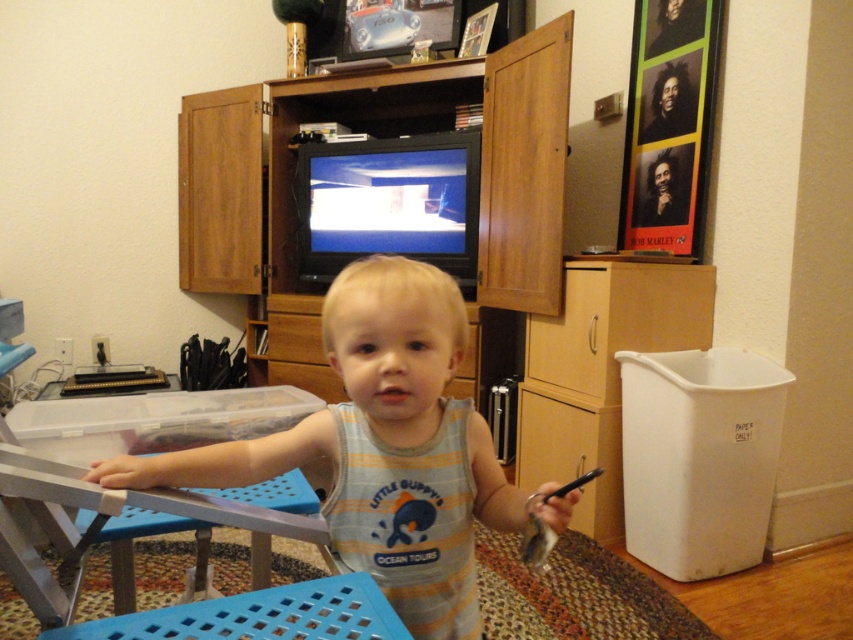
Question: Observing the image, what is the correct spatial positioning of gray striped tank top at center in reference to wooden entertainment center at center?

Choices:
 (A) below
 (B) above

Answer: (A)

Question: Which point is closer to the camera taking this photo?

Choices:
 (A) (492, 76)
 (B) (409, 454)

Answer: (B)

Question: Which of the following is the farthest from the observer?

Choices:
 (A) (349, 509)
 (B) (340, 394)

Answer: (B)

Question: Can you confirm if gray striped tank top at center is positioned to the left of wooden entertainment center at center?

Choices:
 (A) no
 (B) yes

Answer: (A)

Question: Does gray striped tank top at center have a lesser width compared to wooden entertainment center at center?

Choices:
 (A) yes
 (B) no

Answer: (A)